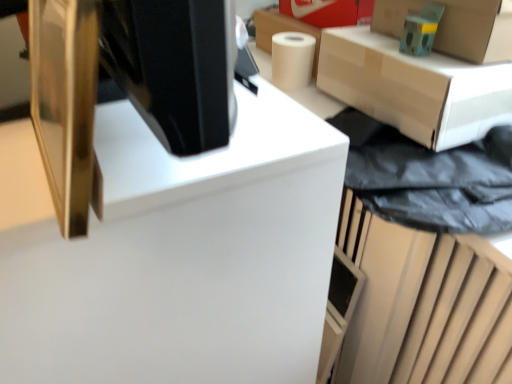
Question: In terms of size, does teal matte toy at upper right appear bigger or smaller than white matte paper towel at upper right?

Choices:
 (A) big
 (B) small

Answer: (B)

Question: Visually, is teal matte toy at upper right positioned to the left or to the right of white matte paper towel at upper right?

Choices:
 (A) left
 (B) right

Answer: (B)

Question: Based on their relative distances, which object is nearer to the matte cardboard box at upper right?

Choices:
 (A) teal matte toy at upper right
 (B) white matte paper towel at upper right
 (C) gold metallic monitor at upper left
 (D) white glossy computer desk at center
 (E) cardboard box at upper right

Answer: (E)

Question: Which object is positioned farthest from the gold metallic monitor at upper left?

Choices:
 (A) white matte paper towel at upper right
 (B) matte cardboard box at upper right
 (C) cardboard box at upper right
 (D) white glossy computer desk at center
 (E) teal matte toy at upper right

Answer: (A)